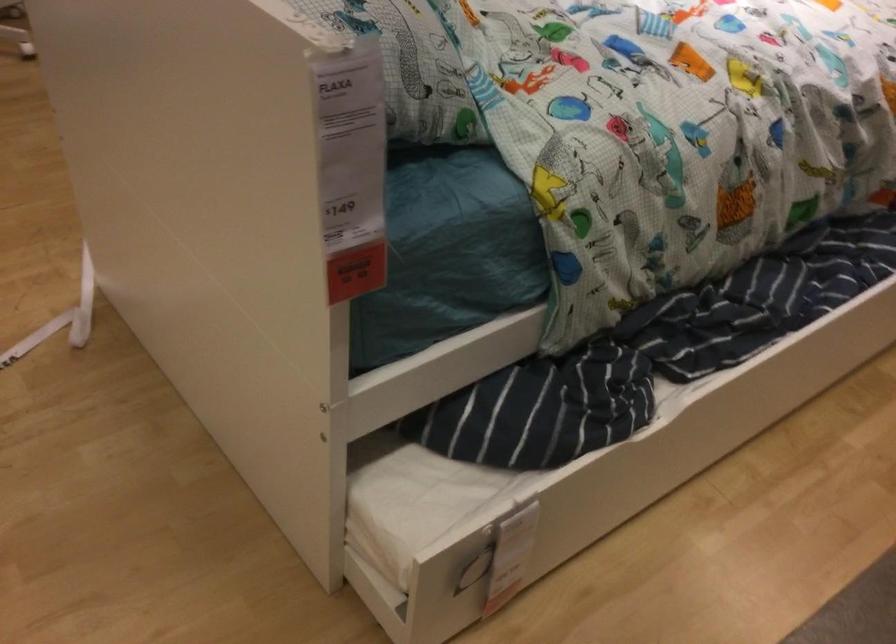
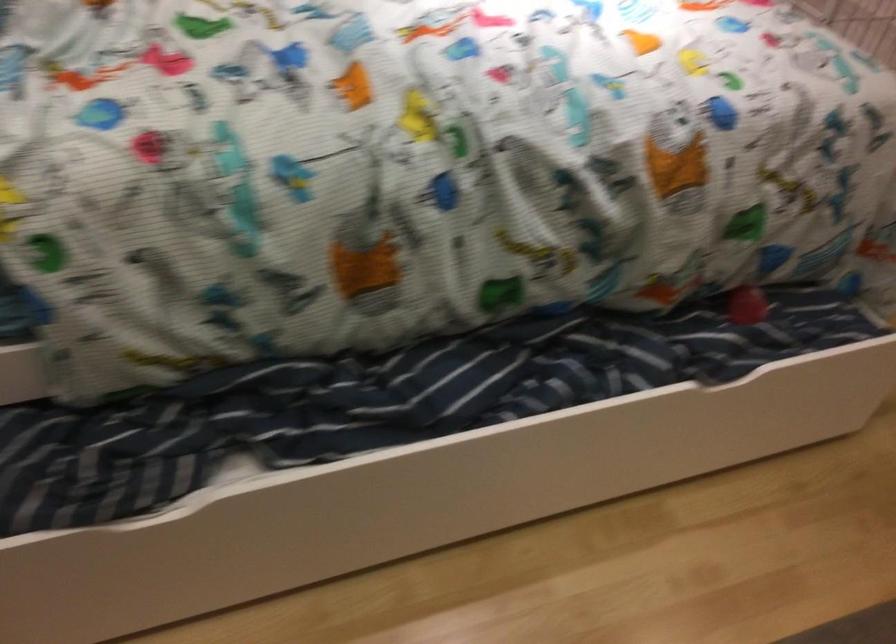
Question: The camera is either moving clockwise (left) or counter-clockwise (right) around the object. The first image is from the beginning of the video and the second image is from the end. Is the camera moving left or right when shooting the video?

Choices:
 (A) Left
 (B) Right

Answer: (B)